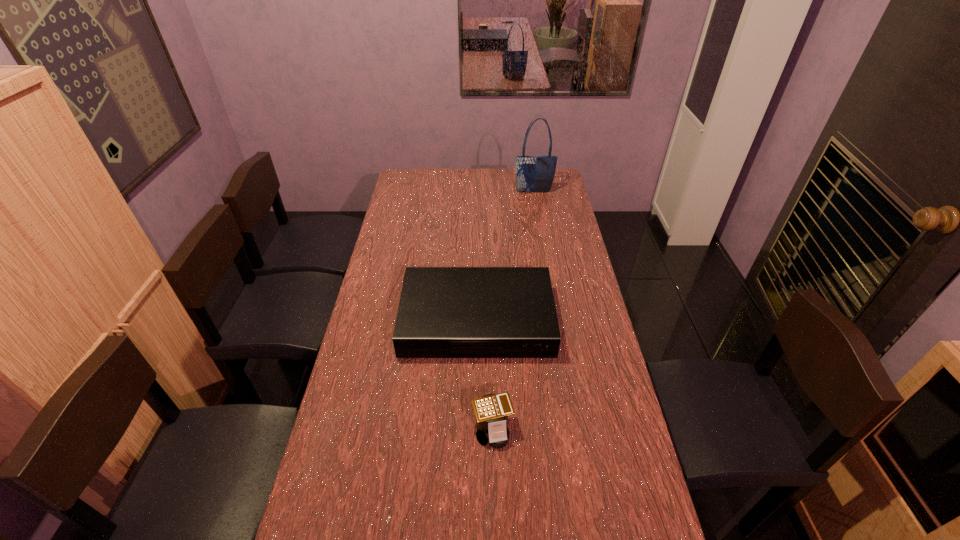
At what (x,y) coordinates should I click in order to perform the action: click on object that is the closest to the nearest object. Please return your answer as a coordinate pair (x, y). This screenshot has height=540, width=960. Looking at the image, I should click on (444, 312).

Find the location of a particular element. The height and width of the screenshot is (540, 960). free point that satisfies the following two spatial constraints: 1. at the front of the second nearest object for disc insertion; 2. on the left side of the calculator is located at coordinates (476, 429).